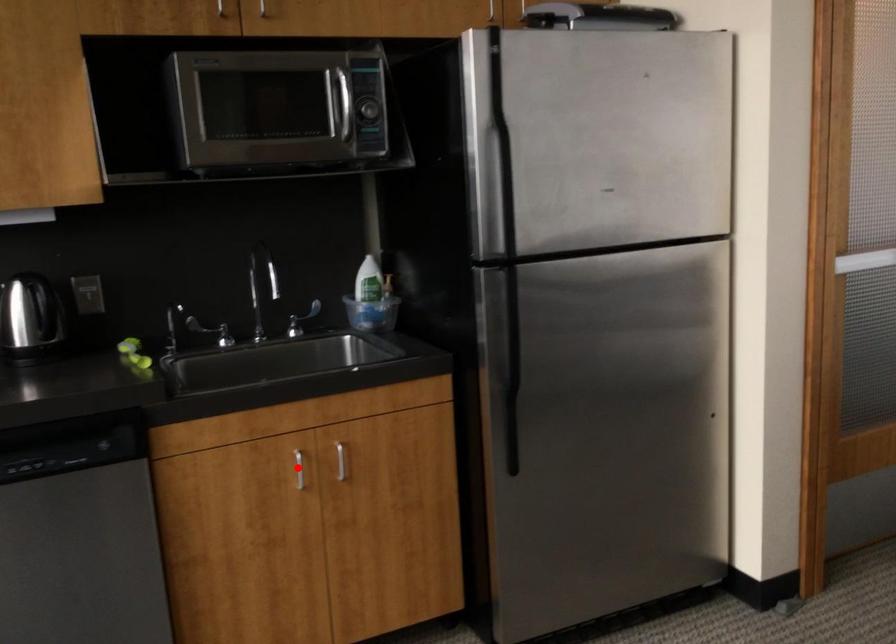
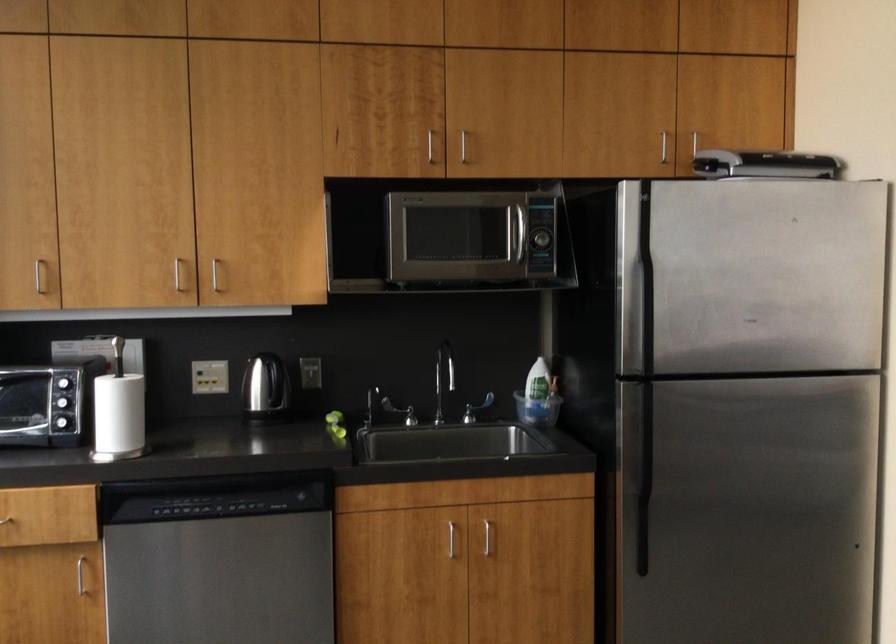
Question: I am providing you with two images of the same scene from different viewpoints. Given a red point in image1, look at the same physical point in image2. Is it:

Choices:
 (A) Closer to the viewpoint
 (B) Farther from the viewpoint

Answer: (B)